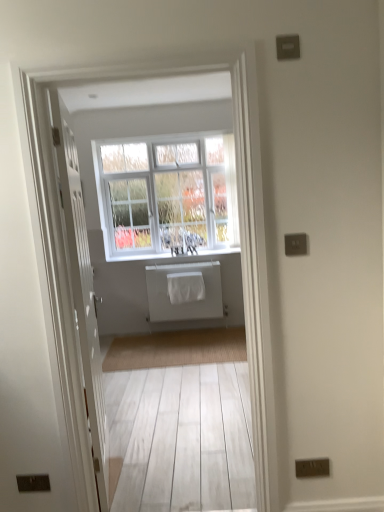
Question: Is white wooden door at center positioned in front of white textured window at center?

Choices:
 (A) no
 (B) yes

Answer: (B)

Question: From the image's perspective, is white wooden door at center on white textured window at center?

Choices:
 (A) no
 (B) yes

Answer: (A)

Question: From a real-world perspective, is white wooden door at center located higher than white textured window at center?

Choices:
 (A) no
 (B) yes

Answer: (A)

Question: Does white wooden door at center have a greater width compared to white textured window at center?

Choices:
 (A) yes
 (B) no

Answer: (B)

Question: Is white wooden door at center taller than white textured window at center?

Choices:
 (A) no
 (B) yes

Answer: (B)

Question: From the image's perspective, is white painted wood at center located above or below white matte radiator at center?

Choices:
 (A) below
 (B) above

Answer: (B)

Question: From their relative heights in the image, would you say white painted wood at center is taller or shorter than white matte radiator at center?

Choices:
 (A) short
 (B) tall

Answer: (A)

Question: Is point (158, 260) positioned closer to the camera than point (162, 266)?

Choices:
 (A) farther
 (B) closer

Answer: (A)

Question: Choose the correct answer: Is white painted wood at center inside white matte radiator at center or outside it?

Choices:
 (A) inside
 (B) outside

Answer: (B)

Question: Considering their positions, is white painted wood at center located in front of or behind white textured window at center?

Choices:
 (A) behind
 (B) front

Answer: (A)

Question: In terms of size, does white painted wood at center appear bigger or smaller than white textured window at center?

Choices:
 (A) big
 (B) small

Answer: (B)

Question: Is white painted wood at center inside the boundaries of white textured window at center, or outside?

Choices:
 (A) inside
 (B) outside

Answer: (A)

Question: From the image's perspective, is white painted wood at center above or below white textured window at center?

Choices:
 (A) above
 (B) below

Answer: (B)

Question: From a real-world perspective, is white matte radiator at center positioned above or below white textured window at center?

Choices:
 (A) below
 (B) above

Answer: (A)

Question: From the image's perspective, relative to white textured window at center, is white matte radiator at center above or below?

Choices:
 (A) above
 (B) below

Answer: (B)